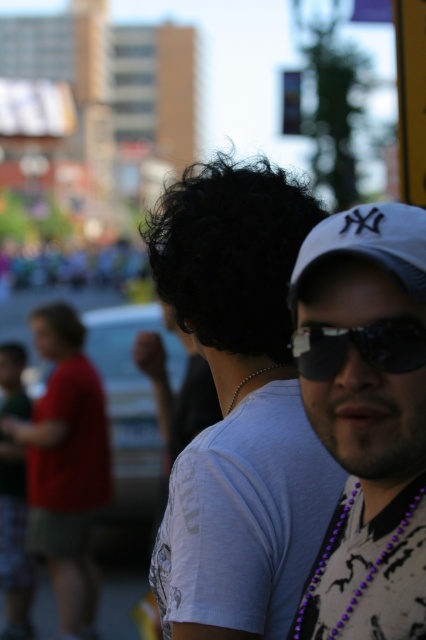
You are a photographer who wants to adjust the focus to capture both the matte red shirt at left and the purple beaded necklace at lower right clearly. Based on their positions in the scene, do you think it is possible to have both in focus without changing the camera settings?

The matte red shirt at left is located below the purple beaded necklace at lower right. Since the photographer used a shallow depth of field, which blurs the background and keeps the foreground sharp, the necklace at lower right might be closer to the camera than the shirt. If they are at significantly different distances, both might not be in focus simultaneously without adjusting the settings.

You are a photographer trying to capture a closeup of the matte red shirt at left and the purple beaded necklace at lower right. Given that your camera can only focus on one object at a time, which object should you choose to ensure the larger one is in focus?

The matte red shirt at left is bigger than the purple beaded necklace at lower right, so you should focus on the matte red shirt at left to ensure the larger object is in focus.